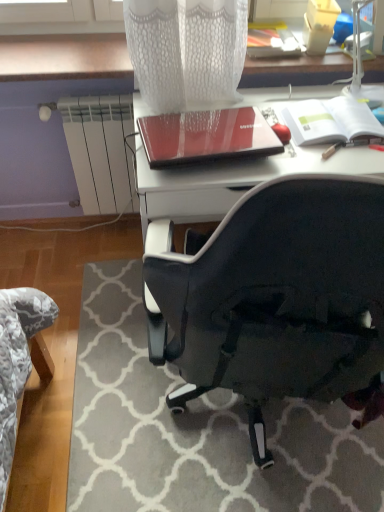
Question: Visually, is white matte notebook at upper right, the 2th notebook in the left-to-right sequence, positioned to the left or to the right of white mesh table lamp at upper right?

Choices:
 (A) left
 (B) right

Answer: (A)

Question: Is white matte notebook at upper right, the 2th notebook in the left-to-right sequence, spatially inside white mesh table lamp at upper right, or outside of it?

Choices:
 (A) outside
 (B) inside

Answer: (A)

Question: Considering the real-world distances, which object is farthest from the red glossy notebook at upper center, marked as the 1th notebook in a left-to-right arrangement?

Choices:
 (A) white mesh table lamp at upper right
 (B) white matte notebook at upper right, the 1th notebook from the right
 (C) black fabric chair at lower right

Answer: (C)

Question: Based on their relative distances, which object is nearer to the white mesh table lamp at upper right?

Choices:
 (A) white matte notebook at upper right, the 2th notebook in the left-to-right sequence
 (B) black fabric chair at lower right
 (C) red glossy notebook at upper center, which is the 2th notebook from right to left

Answer: (A)